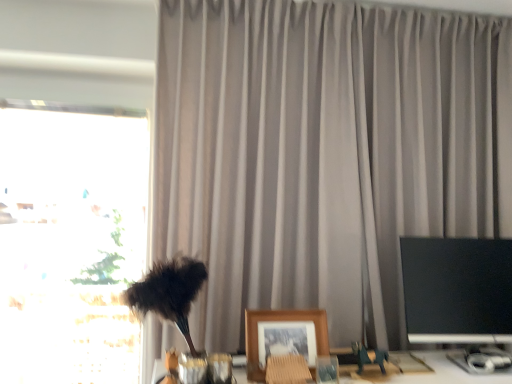
The image size is (512, 384). In order to click on vacant point above matte gray curtain at center (from a real-world perspective) in this screenshot , I will do `click(408, 8)`.